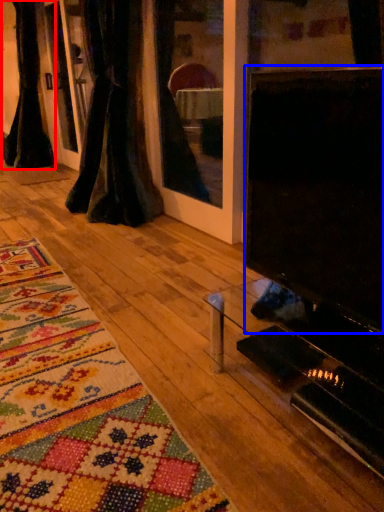
Question: Which object appears closest to the camera in this image, curtain (highlighted by a red box) or screen (highlighted by a blue box)?

Choices:
 (A) curtain
 (B) screen

Answer: (B)